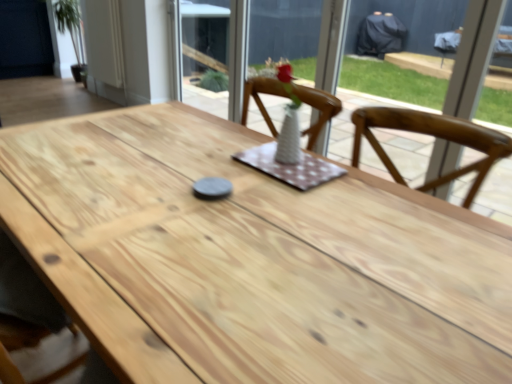
Question: From a real-world perspective, is white wood door at upper left positioned above or below white ceramic vase at center?

Choices:
 (A) above
 (B) below

Answer: (B)

Question: Is white wood door at upper left situated inside white ceramic vase at center or outside?

Choices:
 (A) outside
 (B) inside

Answer: (A)

Question: Which is farther from the white glass vase at upper center?

Choices:
 (A) white ceramic vase at center
 (B) white wood door at upper left
 (C) natural wood table at center

Answer: (C)

Question: Based on their relative distances, which object is nearer to the white glass vase at upper center?

Choices:
 (A) white ceramic vase at center
 (B) white wood door at upper left
 (C) natural wood table at center

Answer: (B)